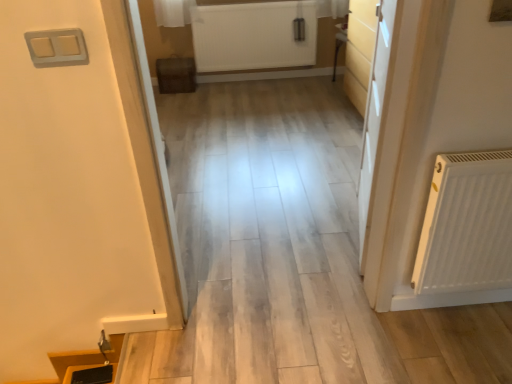
Where is `empty space that is ontop of white matte radiator at upper center (from a real-world perspective)`? empty space that is ontop of white matte radiator at upper center (from a real-world perspective) is located at coordinates (237, 0).